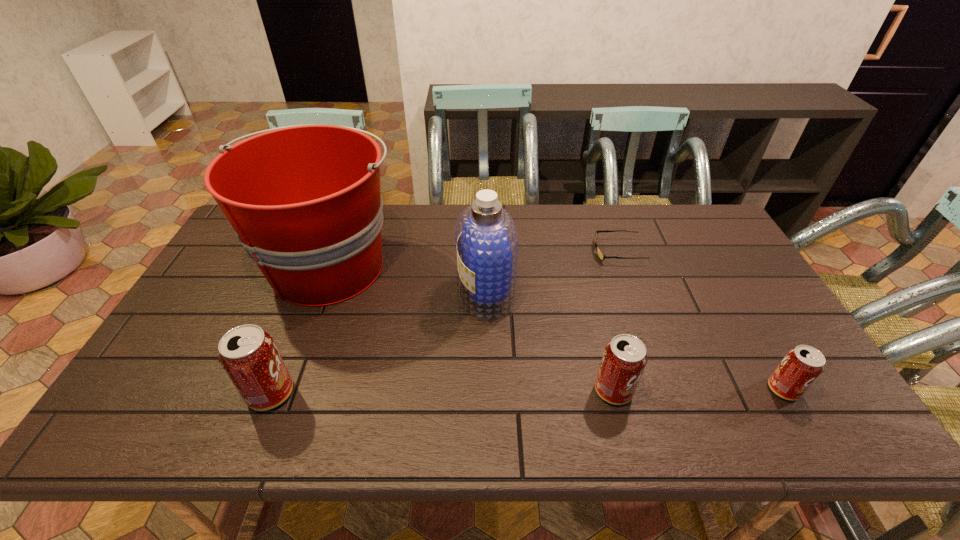
The width and height of the screenshot is (960, 540). Find the location of `vacant space that satisfies the following two spatial constraints: 1. on the back side of the fourth shortest object; 2. on the left side of the third object from left to right`. vacant space that satisfies the following two spatial constraints: 1. on the back side of the fourth shortest object; 2. on the left side of the third object from left to right is located at coordinates (310, 294).

At what (x,y) coordinates should I click in order to perform the action: click on vacant region that satisfies the following two spatial constraints: 1. on the front-facing side of the shortest object; 2. on the front side of the third object from right to left. Please return your answer as a coordinate pair (x, y). The height and width of the screenshot is (540, 960). Looking at the image, I should click on (667, 390).

You are a GUI agent. You are given a task and a screenshot of the screen. Output one action in this format:
    pyautogui.click(x=<x>, y=<y>)
    Task: Click on the free space that satisfies the following two spatial constraints: 1. on the back side of the bucket; 2. on the left side of the tallest soda can
    The image size is (960, 540).
    Given the screenshot: What is the action you would take?
    pyautogui.click(x=322, y=266)